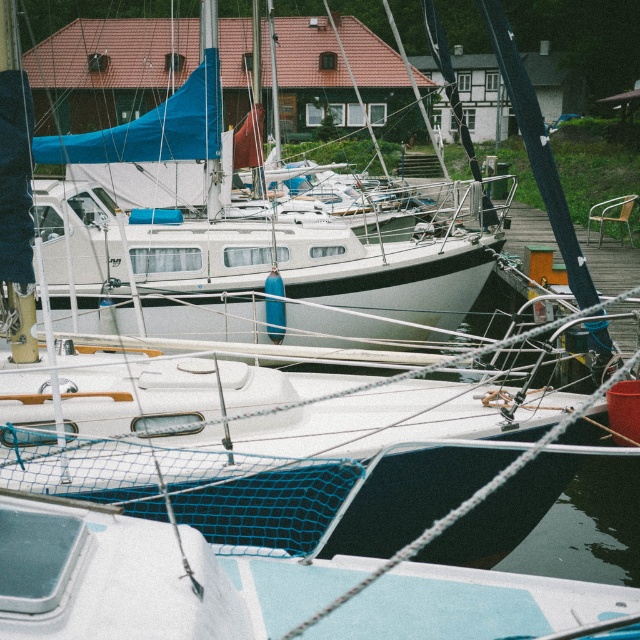
Question: Is white matte sailboat at center positioned behind white matte boat at center?

Choices:
 (A) no
 (B) yes

Answer: (B)

Question: Which of the following is the closest to the observer?

Choices:
 (A) (10, 573)
 (B) (161, 275)

Answer: (A)

Question: In this image, where is white matte sailboat at center located relative to white matte boat at center?

Choices:
 (A) right
 (B) left

Answer: (B)

Question: Does white matte sailboat at center come in front of white matte boat at center?

Choices:
 (A) yes
 (B) no

Answer: (B)